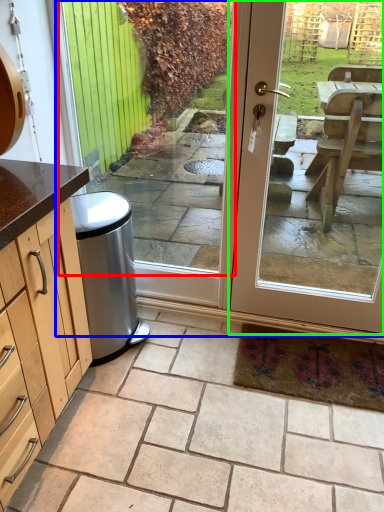
Question: Based on their relative distances, which object is nearer to window (highlighted by a red box)? Choose from screen door (highlighted by a blue box) and door (highlighted by a green box).

Choices:
 (A) screen door
 (B) door

Answer: (A)